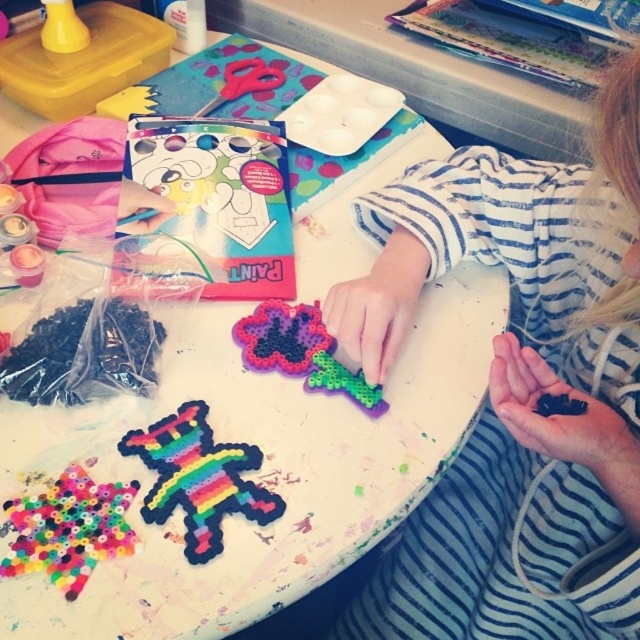
Question: Is striped fabric shirt at center further to the viewer compared to translucent plastic flower at center?

Choices:
 (A) no
 (B) yes

Answer: (A)

Question: Considering the relative positions of striped fabric shirt at center and rainbow plastic beads at center in the image provided, where is striped fabric shirt at center located with respect to rainbow plastic beads at center?

Choices:
 (A) above
 (B) below

Answer: (A)

Question: Does striped fabric shirt at center have a lesser width compared to rainbow plastic beads at center?

Choices:
 (A) no
 (B) yes

Answer: (A)

Question: Which object is positioned closest to the translucent plastic flower at center?

Choices:
 (A) rainbow plastic beads at center
 (B) striped fabric shirt at center
 (C) rainbow plastic toy at lower left

Answer: (C)

Question: Which of the following is the closest to the observer?

Choices:
 (A) (506, 406)
 (B) (68, 490)
 (C) (237, 508)
 (D) (314, 364)

Answer: (C)

Question: Which object is the closest to the rainbow plastic toy at lower left?

Choices:
 (A) striped fabric shirt at center
 (B) rainbow plastic beads at center
 (C) translucent plastic flower at center

Answer: (B)